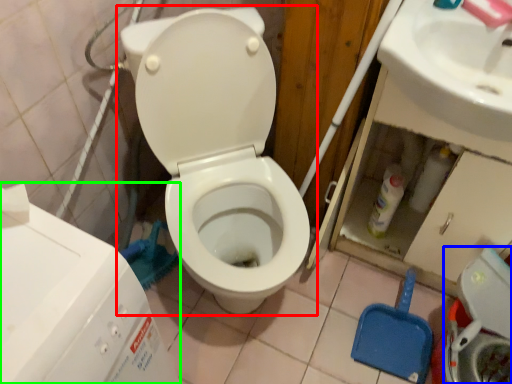
Question: Which object is the farthest from toilet (highlighted by a red box)? Choose among these: washer (highlighted by a blue box) or water tank (highlighted by a green box).

Choices:
 (A) washer
 (B) water tank

Answer: (A)